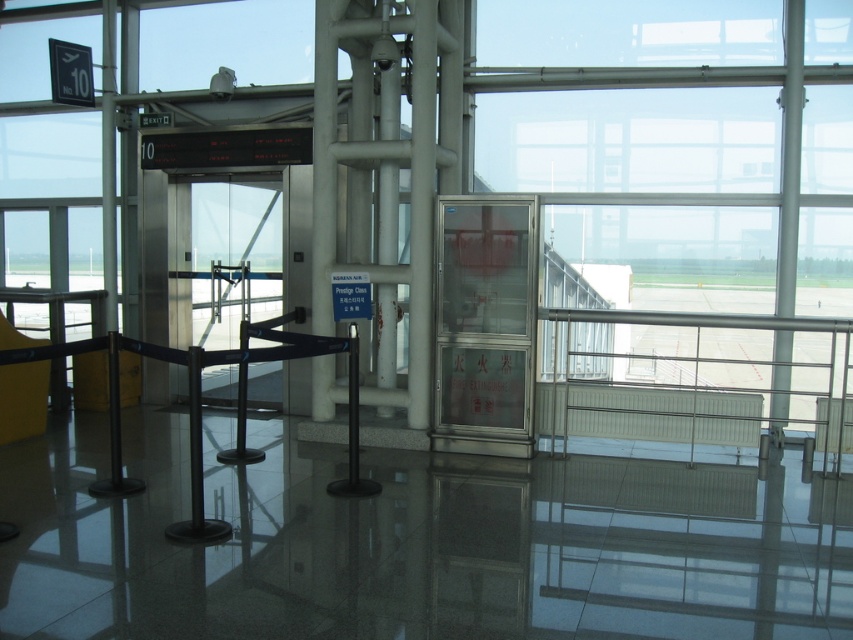
Is transparent glass window at center to the left of transparent glass fire extinguisher at center from the viewer's perspective?

In fact, transparent glass window at center is to the right of transparent glass fire extinguisher at center.

Image resolution: width=853 pixels, height=640 pixels. What do you see at coordinates (688, 173) in the screenshot?
I see `transparent glass window at center` at bounding box center [688, 173].

I want to click on transparent glass window at center, so [688, 173].